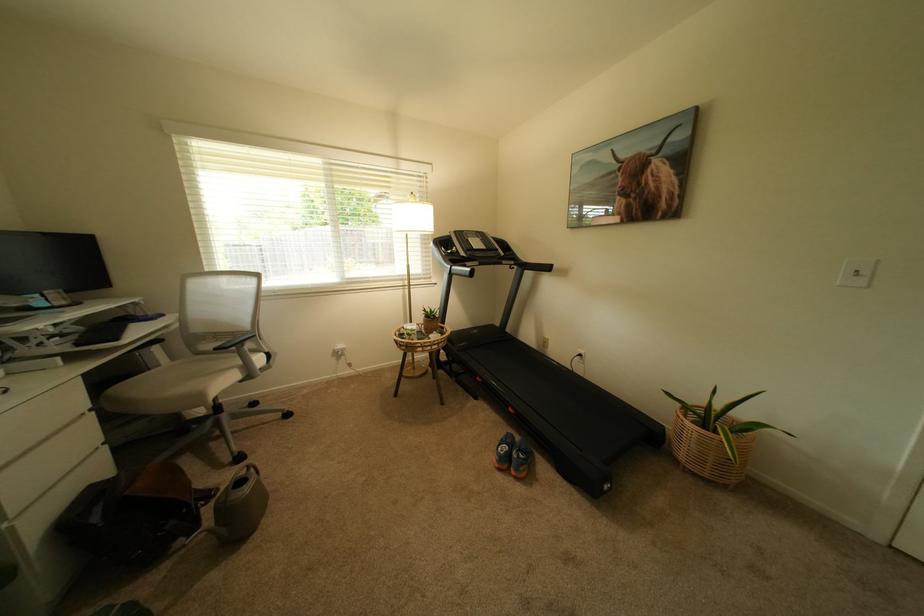
Describe the element at coordinates (856, 273) in the screenshot. I see `the wall light switch` at that location.